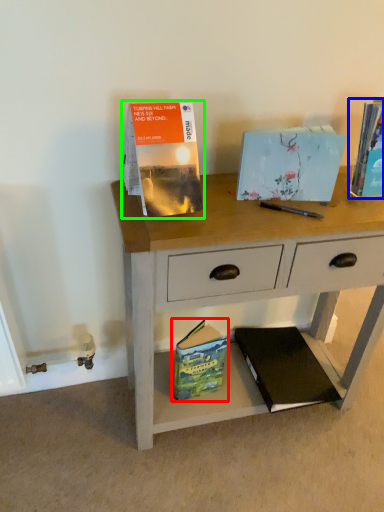
Question: Which is nearer to the paperback book (highlighted by a red box)? paperback book (highlighted by a blue box) or paperback book (highlighted by a green box).

Choices:
 (A) paperback book
 (B) paperback book

Answer: (B)